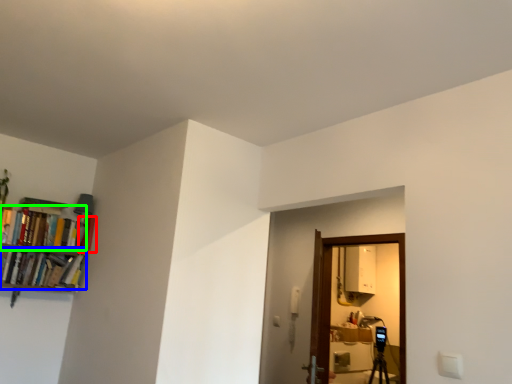
Question: Which object is positioned farthest from book (highlighted by a red box)? Select from book (highlighted by a blue box) and book (highlighted by a green box).

Choices:
 (A) book
 (B) book

Answer: (A)